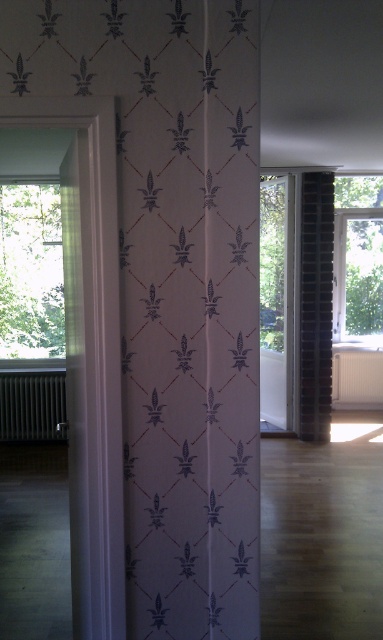
Is dark brick pillar at right below white matte radiator at lower right?

No.

Is dark brick pillar at right behind white matte radiator at lower right?

No.

Where is `dark brick pillar at right`? The width and height of the screenshot is (383, 640). dark brick pillar at right is located at coordinates (315, 305).

Where is `dark brick pillar at right`? The width and height of the screenshot is (383, 640). dark brick pillar at right is located at coordinates (315, 305).

Between white paper curtain at center and black metallic radiator at left, which one has more height?

white paper curtain at center

Can you confirm if white paper curtain at center is positioned to the left of black metallic radiator at left?

Incorrect, white paper curtain at center is not on the left side of black metallic radiator at left.

Who is more forward, [129,332] or [6,412]?

Point [129,332] is in front.

In order to click on white paper curtain at center in this screenshot , I will do `click(152, 298)`.

Can you confirm if white paper curtain at center is taller than dark brick pillar at right?

No, white paper curtain at center is not taller than dark brick pillar at right.

Between white paper curtain at center and dark brick pillar at right, which one has less height?

white paper curtain at center is shorter.

The image size is (383, 640). What are the coordinates of `white paper curtain at center` in the screenshot? It's located at (152, 298).